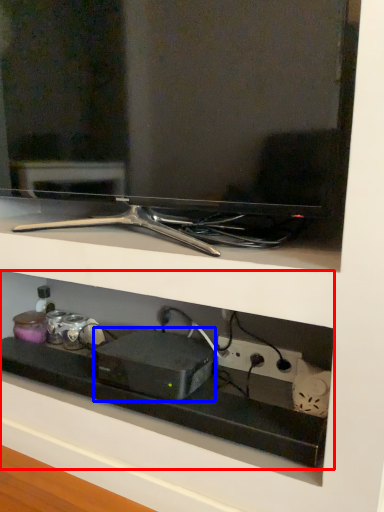
Question: Among these objects, which one is farthest to the camera, shelf (highlighted by a red box) or appliance (highlighted by a blue box)?

Choices:
 (A) shelf
 (B) appliance

Answer: (B)